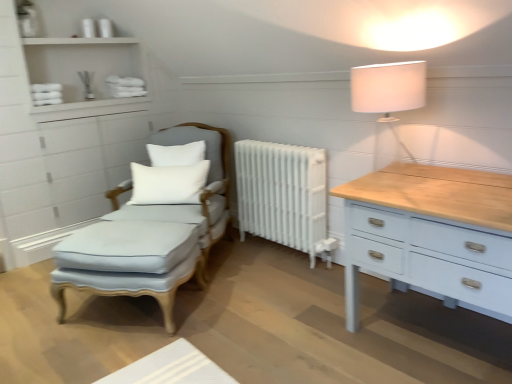
Question: Is white fabric lampshade at upper right wider or thinner than light blue fabric swivel chair at center-left?

Choices:
 (A) thin
 (B) wide

Answer: (A)

Question: Is white fabric lampshade at upper right taller or shorter than light blue fabric swivel chair at center-left?

Choices:
 (A) short
 (B) tall

Answer: (A)

Question: Which object is positioned farthest from the white painted radiator at center?

Choices:
 (A) light blue fabric footrest at center
 (B) light blue fabric swivel chair at center-left
 (C) white matte pillow at center, positioned as the 2th pillow in bottom-to-top order
 (D) white fabric lampshade at upper right
 (E) white matte shelves at upper left

Answer: (E)

Question: Estimate the real-world distances between objects in this image. Which object is farther from the white fabric lampshade at upper right?

Choices:
 (A) light blue fabric swivel chair at center-left
 (B) light blue fabric footrest at center
 (C) white soft cushion at center, which is the first pillow in bottom-to-top order
 (D) white matte pillow at center, positioned as the 2th pillow in bottom-to-top order
 (E) white matte shelves at upper left

Answer: (E)